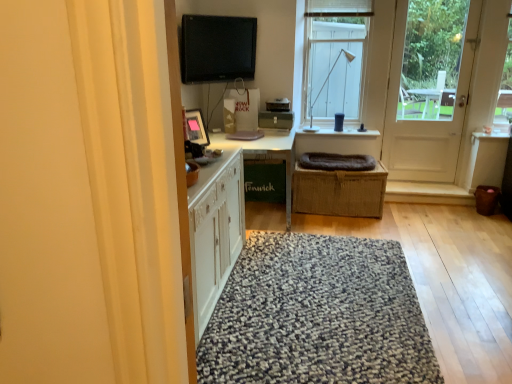
Image resolution: width=512 pixels, height=384 pixels. Find the location of `unoccupied region to the right of textured gray rug at center`. unoccupied region to the right of textured gray rug at center is located at coordinates (466, 288).